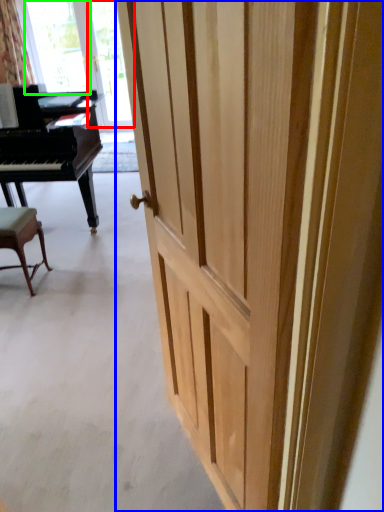
Question: Estimate the real-world distances between objects in this image. Which object is closer to glass door (highlighted by a red box), door (highlighted by a blue box) or window screen (highlighted by a green box)?

Choices:
 (A) door
 (B) window screen

Answer: (B)